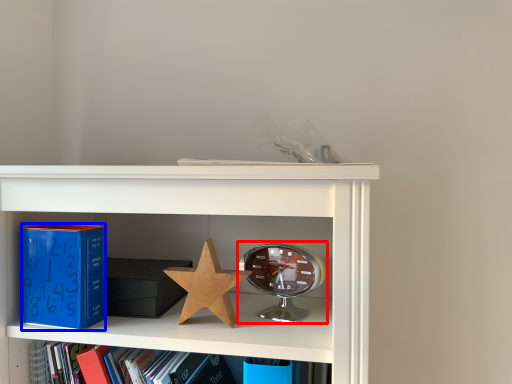
Question: Which object is closer to the camera taking this photo, alarm clock (highlighted by a red box) or paperback book (highlighted by a blue box)?

Choices:
 (A) alarm clock
 (B) paperback book

Answer: (B)